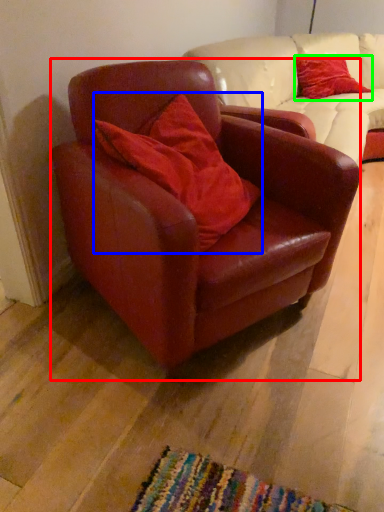
Question: Which object is positioned closest to chair (highlighted by a red box)? Select from pillow (highlighted by a blue box) and pillow (highlighted by a green box).

Choices:
 (A) pillow
 (B) pillow

Answer: (A)